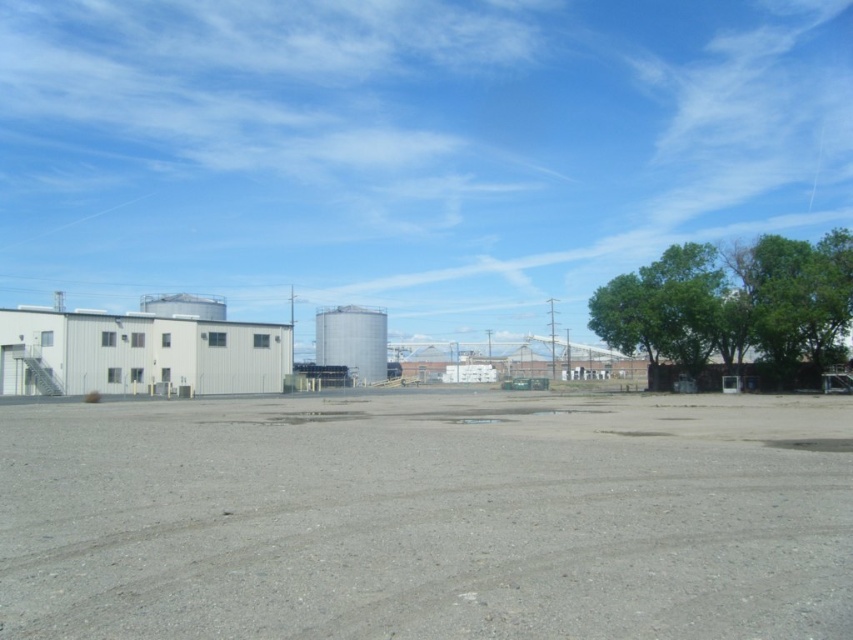
Does green leafy tree at right have a lesser height compared to green leafy tree at upper right?

Incorrect, green leafy tree at right's height does not fall short of green leafy tree at upper right's.

Can you confirm if green leafy tree at right is positioned to the right of green leafy tree at upper right?

No, green leafy tree at right is not to the right of green leafy tree at upper right.

Which is behind, point (780, 337) or point (831, 312)?

Positioned behind is point (780, 337).

This screenshot has width=853, height=640. Identify the location of green leafy tree at right. (732, 304).

Does gray gravel dirt track at center appear on the left side of green leafy tree at right?

Indeed, gray gravel dirt track at center is positioned on the left side of green leafy tree at right.

Between point (123, 532) and point (718, 339), which one is positioned in front?

Point (123, 532) is more forward.

Find the location of a particular element. gray gravel dirt track at center is located at coordinates (428, 516).

Between point (345, 589) and point (373, 339), which one is positioned behind?

Point (373, 339)

Which of these two, gray gravel dirt track at center or silver metallic silo at center, stands taller?

silver metallic silo at center is taller.

In order to click on gray gravel dirt track at center in this screenshot , I will do `click(428, 516)`.